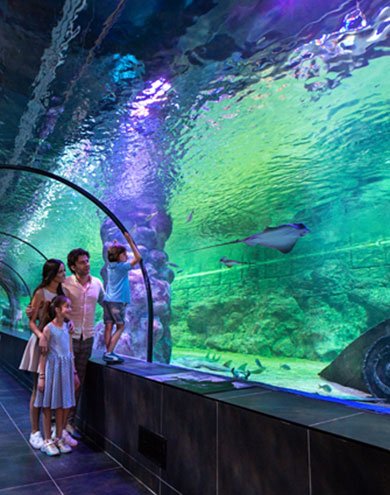
This screenshot has width=390, height=495. In order to click on tile in this screenshot , I will do `click(205, 449)`.